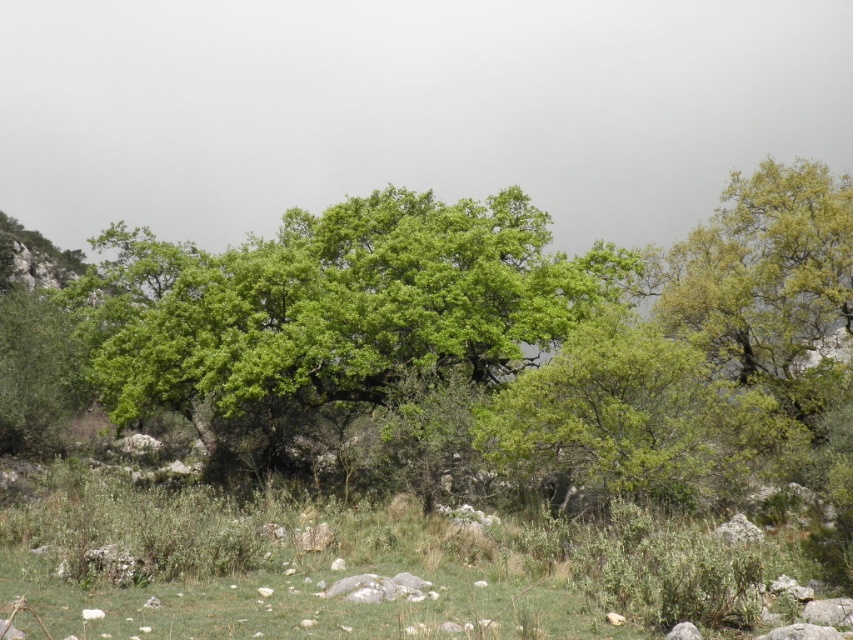
Question: Is green grass at center wider than green leafy tree at center?

Choices:
 (A) yes
 (B) no

Answer: (B)

Question: Considering the relative positions of green grass at center and green leafy tree at center in the image provided, where is green grass at center located with respect to green leafy tree at center?

Choices:
 (A) right
 (B) left

Answer: (A)

Question: Which point is farther to the camera?

Choices:
 (A) (496, 266)
 (B) (119, 616)

Answer: (A)

Question: Considering the relative positions of green grass at center and green leafy tree at center in the image provided, where is green grass at center located with respect to green leafy tree at center?

Choices:
 (A) left
 (B) right

Answer: (B)

Question: Among these objects, which one is nearest to the camera?

Choices:
 (A) green leafy tree at center
 (B) green grass at center

Answer: (B)